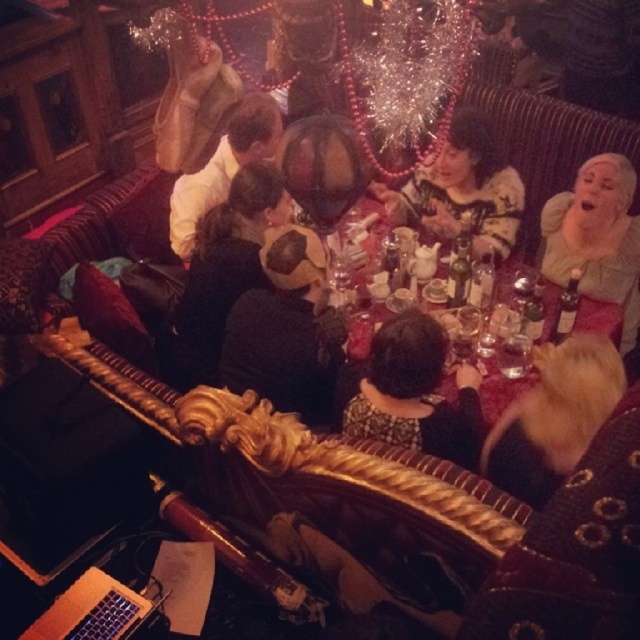
How far apart are black velvet hat at center and patterned sweater at center?

They are 1.09 meters apart.

Does black velvet hat at center have a greater width compared to patterned sweater at center?

No, black velvet hat at center is not wider than patterned sweater at center.

Between point (280, 332) and point (513, 224), which one is positioned behind?

Point (513, 224)

In order to click on black velvet hat at center in this screenshot , I will do `click(285, 330)`.

Who is more forward, (570,456) or (221,168)?

Positioned in front is point (570,456).

Is blonde fur coat at lower right further to the viewer compared to white shirt at upper center?

No.

The width and height of the screenshot is (640, 640). I want to click on blonde fur coat at lower right, so click(x=554, y=417).

Is point (547, 422) farther from camera compared to point (580, 244)?

No, (547, 422) is closer to viewer.

Between blonde fur coat at lower right and green velvet dress at right, which one has less height?

blonde fur coat at lower right is shorter.

Is point (576, 372) farther from viewer compared to point (611, 164)?

No, it is not.

This screenshot has height=640, width=640. Find the location of `blonde fur coat at lower right`. blonde fur coat at lower right is located at coordinates (554, 417).